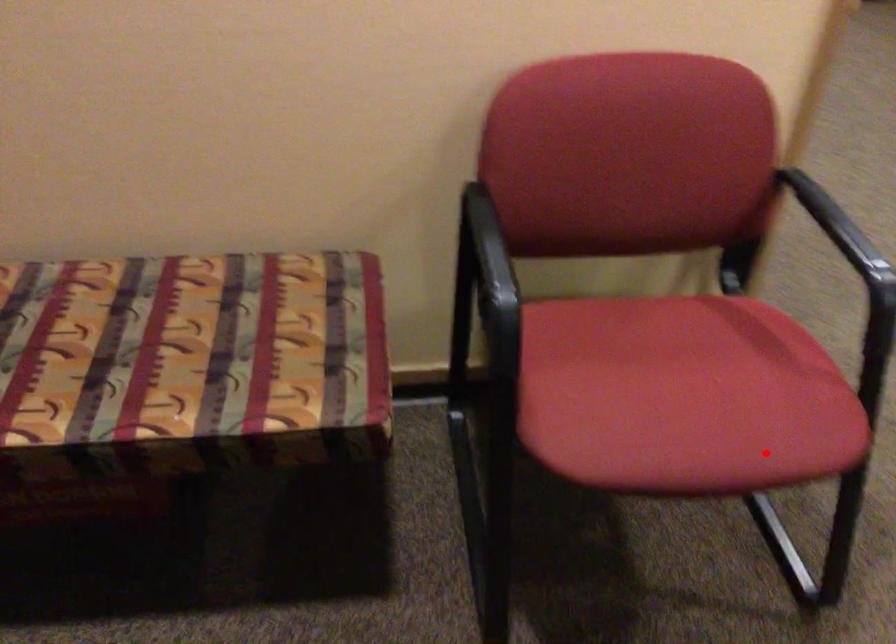
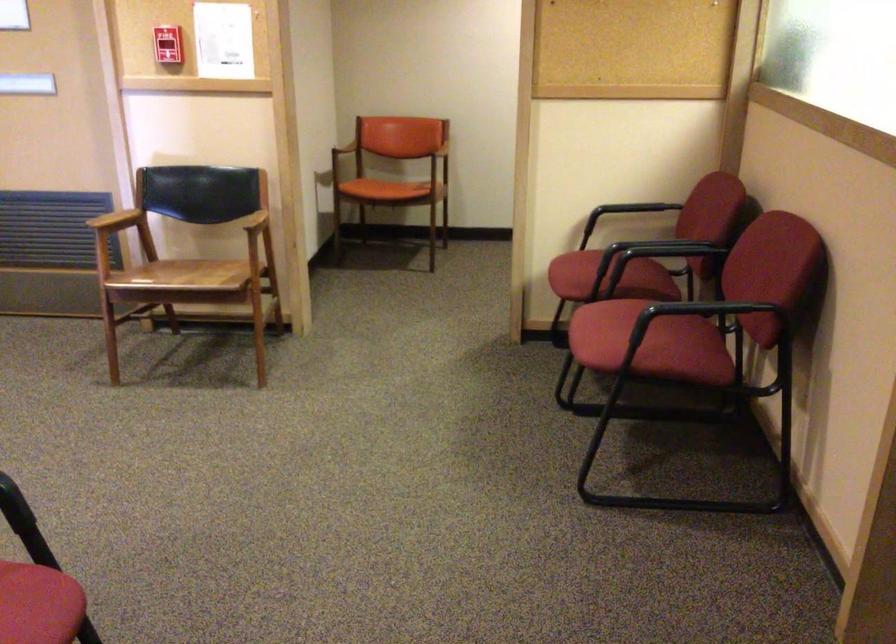
Question: A red point is marked in image1. In image2, is the corresponding 3D point closer to the camera or farther? Reply with the corresponding letter.

Choices:
 (A) The corresponding 3D point is closer.
 (B) The corresponding 3D point is farther.

Answer: (B)